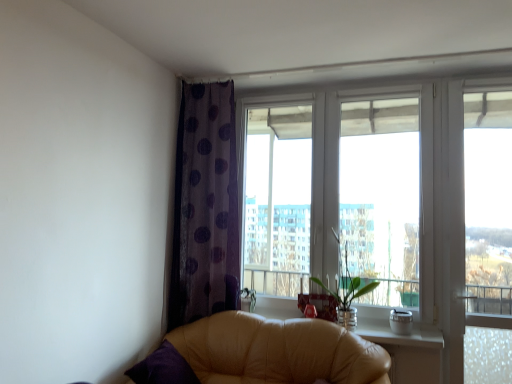
I want to click on free space above purple dotted curtain at left (from a real-world perspective), so click(215, 77).